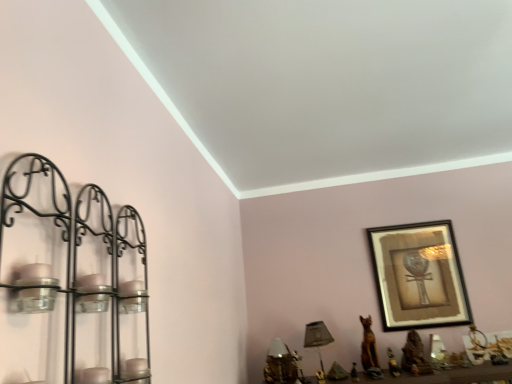
Question: Can you confirm if black metal candle holder at left is positioned to the right of wooden framed picture at upper right?

Choices:
 (A) yes
 (B) no

Answer: (B)

Question: From a real-world perspective, is black metal candle holder at left located beneath wooden framed picture at upper right?

Choices:
 (A) no
 (B) yes

Answer: (B)

Question: Is black metal candle holder at left oriented away from wooden framed picture at upper right?

Choices:
 (A) no
 (B) yes

Answer: (A)

Question: Is black metal candle holder at left positioned behind wooden framed picture at upper right?

Choices:
 (A) yes
 (B) no

Answer: (B)

Question: Is black metal candle holder at left facing towards wooden framed picture at upper right?

Choices:
 (A) no
 (B) yes

Answer: (A)

Question: Can we say black metal candle holder at left lies outside wooden framed picture at upper right?

Choices:
 (A) yes
 (B) no

Answer: (A)

Question: Can you confirm if green fabric table lamp at lower center, which is the second table lamp in left-to-right order, is wider than gold metallic table lamp at lower center, positioned as the 2th table lamp in right-to-left order?

Choices:
 (A) no
 (B) yes

Answer: (B)

Question: Is green fabric table lamp at lower center, the 1th table lamp in the right-to-left sequence, outside gold metallic table lamp at lower center, the first table lamp viewed from the left?

Choices:
 (A) no
 (B) yes

Answer: (B)

Question: Considering the relative positions of green fabric table lamp at lower center, the 1th table lamp in the right-to-left sequence, and gold metallic table lamp at lower center, the first table lamp viewed from the left, in the image provided, is green fabric table lamp at lower center, the 1th table lamp in the right-to-left sequence, to the right of gold metallic table lamp at lower center, the first table lamp viewed from the left, from the viewer's perspective?

Choices:
 (A) yes
 (B) no

Answer: (A)

Question: Can you confirm if green fabric table lamp at lower center, which is the second table lamp in left-to-right order, is shorter than gold metallic table lamp at lower center, positioned as the 2th table lamp in right-to-left order?

Choices:
 (A) yes
 (B) no

Answer: (B)

Question: Can gold metallic table lamp at lower center, the first table lamp viewed from the left, be found inside green fabric table lamp at lower center, the 1th table lamp in the right-to-left sequence?

Choices:
 (A) yes
 (B) no

Answer: (B)

Question: Is green fabric table lamp at lower center, the 1th table lamp in the right-to-left sequence, in contact with gold metallic table lamp at lower center, the first table lamp viewed from the left?

Choices:
 (A) yes
 (B) no

Answer: (B)

Question: Can you confirm if wooden framed picture at upper right is taller than gold metallic table lamp at lower center, positioned as the 2th table lamp in right-to-left order?

Choices:
 (A) no
 (B) yes

Answer: (B)